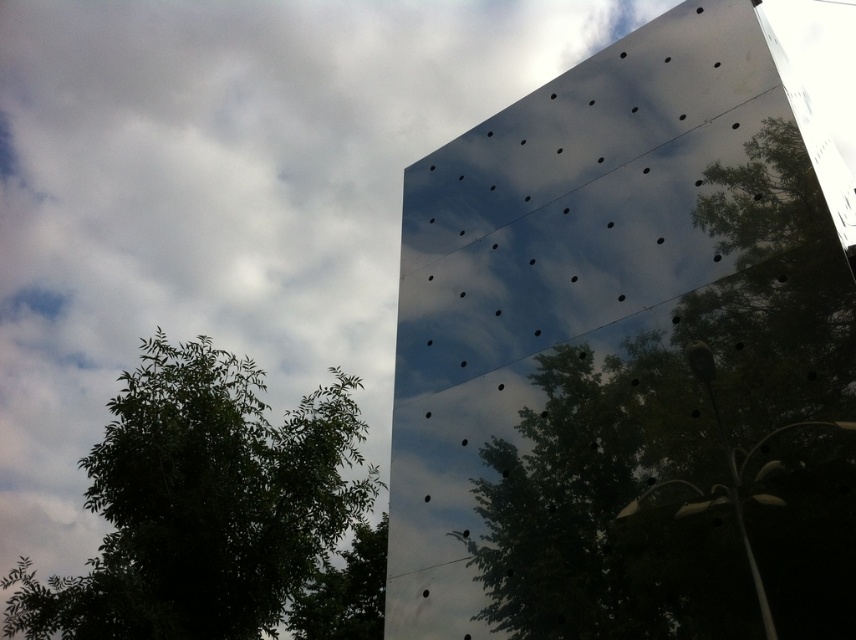
Is green leafy tree at upper center wider than green leafy tree at lower left?

Yes.

Does green leafy tree at upper center appear on the right side of green leafy tree at lower left?

Yes, green leafy tree at upper center is to the right of green leafy tree at lower left.

Does point (819, 404) come closer to viewer compared to point (345, 563)?

Yes, it is in front of point (345, 563).

Find the location of a particular element. Image resolution: width=856 pixels, height=640 pixels. green leafy tree at upper center is located at coordinates (693, 444).

Does green leafy tree at upper left appear under green leafy tree at lower left?

No, green leafy tree at upper left is not below green leafy tree at lower left.

Does green leafy tree at upper left have a lesser width compared to green leafy tree at lower left?

No.

Who is more distant from viewer, (132, 563) or (311, 632)?

The point (311, 632) is more distant.

The image size is (856, 640). I want to click on green leafy tree at upper left, so click(x=201, y=504).

Is point (587, 356) closer to viewer compared to point (146, 534)?

Yes.

Between point (688, 298) and point (346, 445), which one is positioned in front?

Point (688, 298)

Find the location of a particular element. Image resolution: width=856 pixels, height=640 pixels. green leafy tree at upper center is located at coordinates (693, 444).